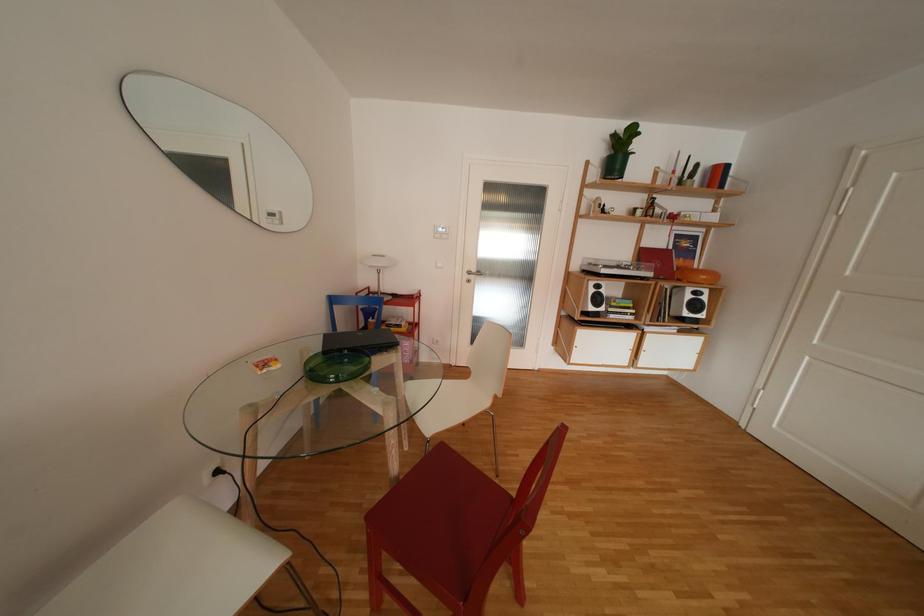
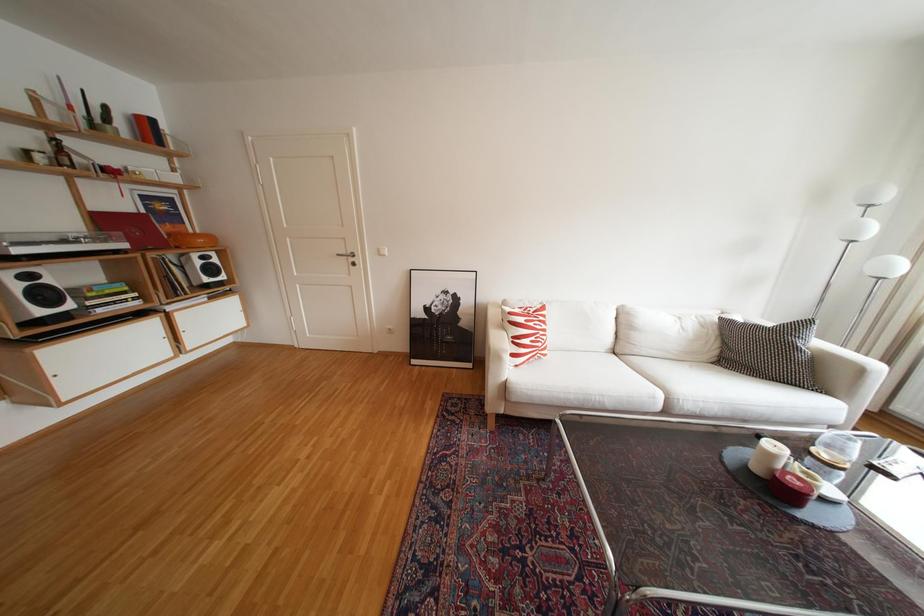
The images are taken continuously from a first-person perspective. In which direction is your viewpoint rotating?

The camera rotated toward right-down.